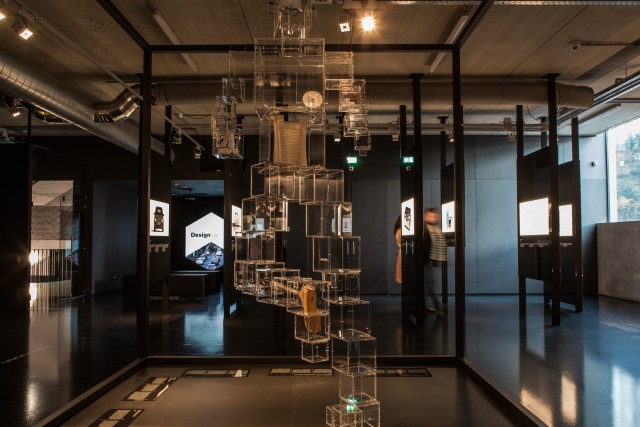
In order to click on light in this screenshot , I will do `click(362, 23)`, `click(340, 24)`, `click(22, 35)`, `click(15, 110)`, `click(1, 17)`, `click(349, 158)`, `click(408, 157)`.